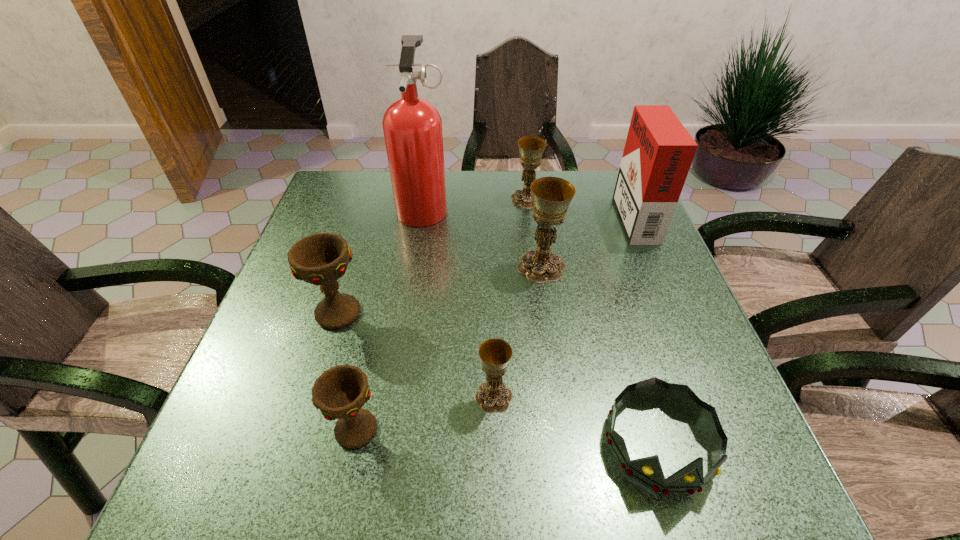
You are a GUI agent. You are given a task and a screenshot of the screen. Output one action in this format:
    pyautogui.click(x=<x>, y=<y>)
    Task: Click on the sixth closest object to the farthest chalice
    This screenshot has width=960, height=540.
    Given the screenshot: What is the action you would take?
    pyautogui.click(x=648, y=471)

Locate an element on the screen. This screenshot has width=960, height=540. chalice that stands as the closest to the fire extinguisher is located at coordinates (531, 148).

Find the location of a particular element. the fourth closest chalice relative to the second tallest object is located at coordinates (321, 259).

The height and width of the screenshot is (540, 960). I want to click on gold chalice that is the third nearest to the smaller red chalice, so click(x=531, y=148).

Select which gold chalice is the third closest to the smaller red chalice. Please provide its 2D coordinates. Your answer should be formatted as a tuple, i.e. [(x, y)], where the tuple contains the x and y coordinates of a point satisfying the conditions above.

[(531, 148)]

You are a GUI agent. You are given a task and a screenshot of the screen. Output one action in this format:
    pyautogui.click(x=<x>, y=<y>)
    Task: Click on the vacant space that satisfies the following two spatial constraints: 1. on the back side of the fire extinguisher; 2. on the left side of the smaller red chalice
    
    Given the screenshot: What is the action you would take?
    [404, 206]